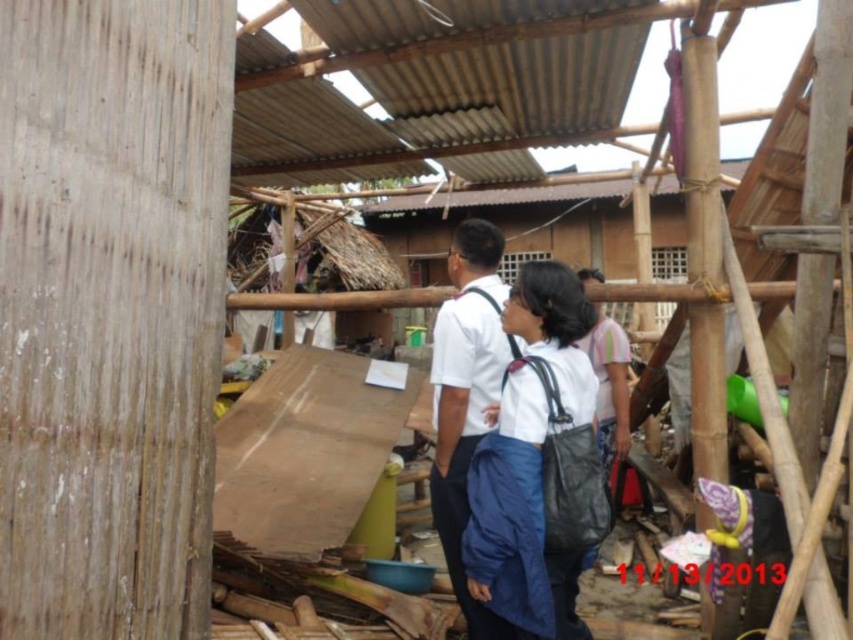
You are a relief worker in the rural area shown. You need to locate the white fabric backpack at center. According to the coordinates provided, where exactly is it positioned?

The white fabric backpack at center is positioned at coordinates point [531,460].

Looking at this image, you are a relief worker in the area and need to carry supplies. You see a white fabric backpack at center and a white matte shirt at center. Which item can hold more items based on their size?

The white fabric backpack at center is bigger than the white matte shirt at center, so it can hold more items.